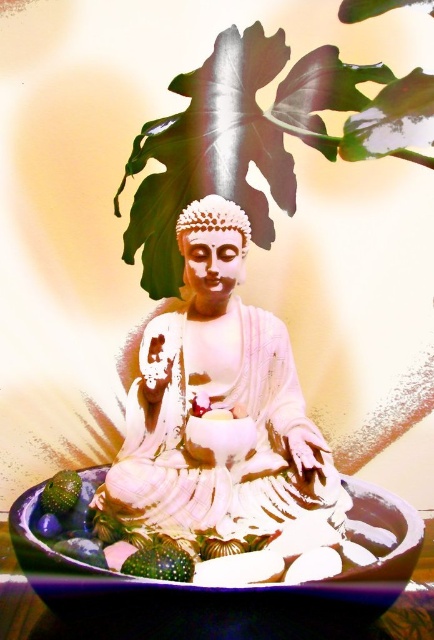
You are standing in front of the seated Buddha statue and notice two points marked in the scene. The first point is at coordinate point (269, 449) and the second is at point (163, 557). Which point is closer to your viewpoint?

Point (269, 449) is closer to your viewpoint because it is further to the viewer than point (163, 557).

You are a visitor at a temple and see the seated Buddha statue. You notice a green leafy plant at upper center and a green matte avocado at lower left. Which object is taller?

The green leafy plant at upper center is taller than the green matte avocado at lower left.